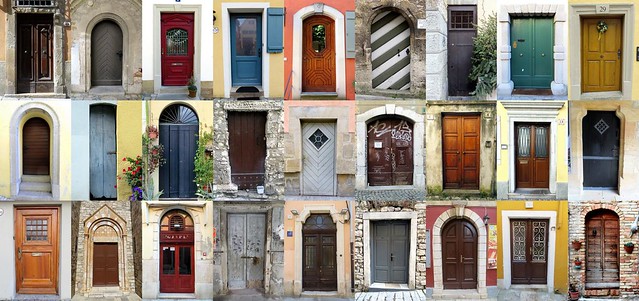
Identify the location of doors with a curved top on it. (606, 245), (458, 254), (173, 254), (43, 145), (190, 149), (381, 59), (310, 52), (112, 45).